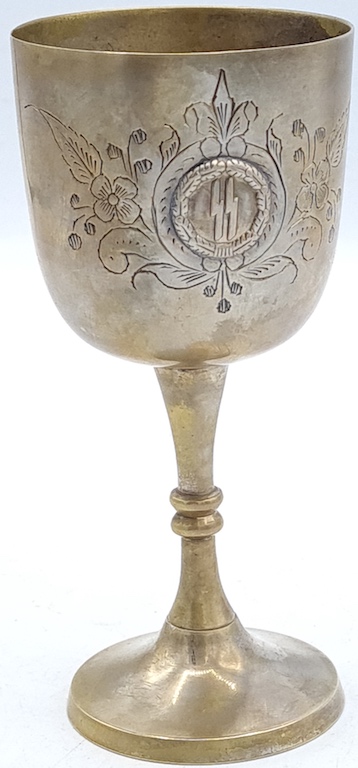
Locate an element on the screen. The height and width of the screenshot is (768, 358). light reflections on the base is located at coordinates (162, 667), (193, 674), (238, 664).